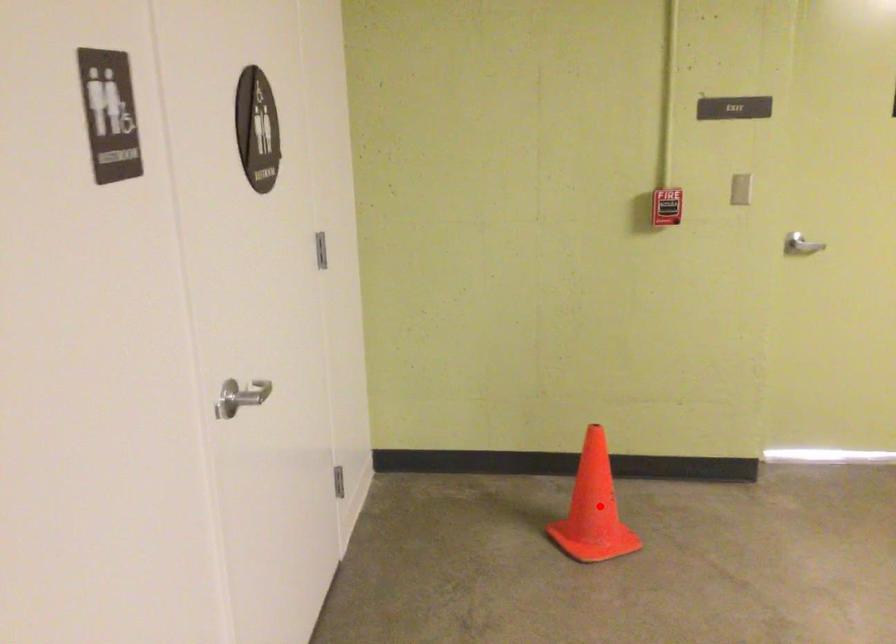
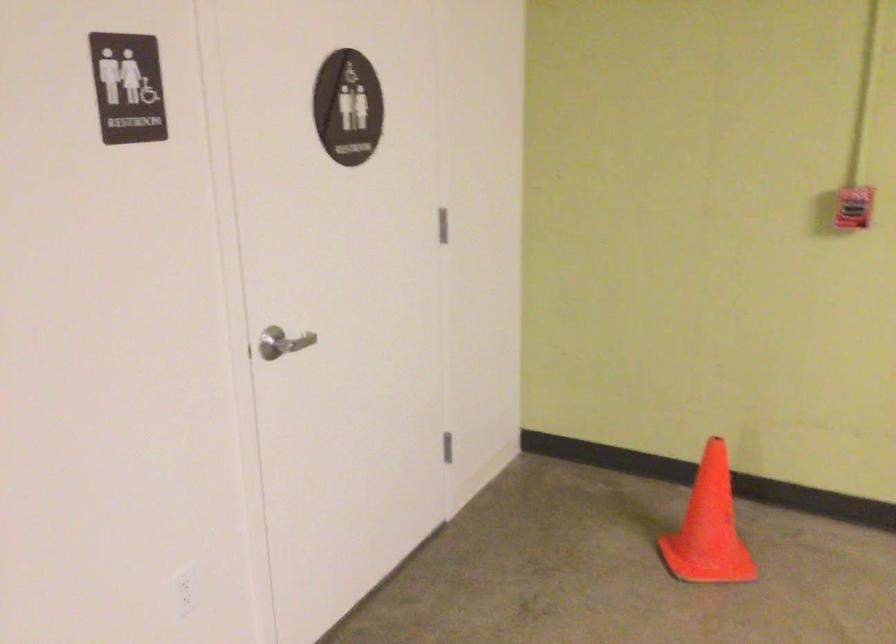
In the second image, find the point that corresponds to the highlighted location in the first image.

(709, 527)